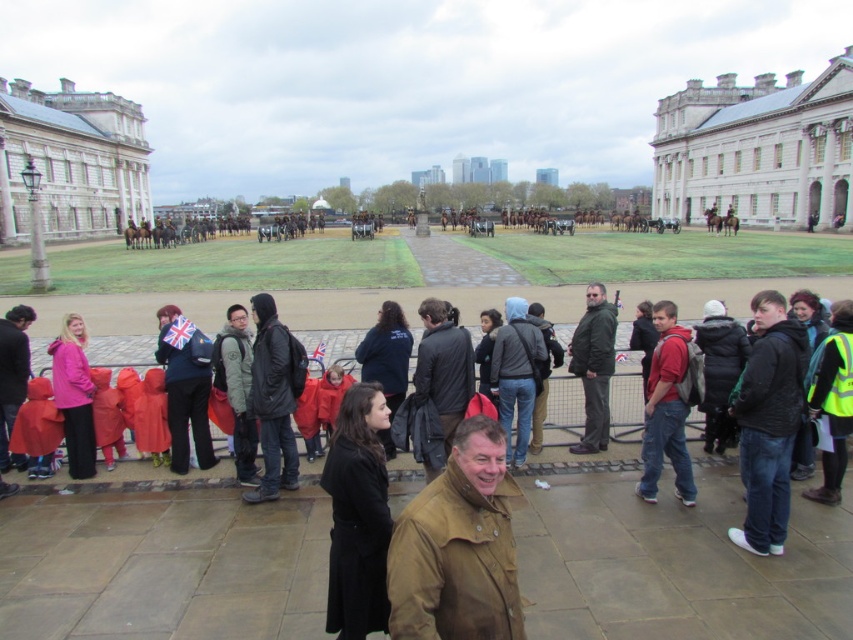
You are standing at the center of the scene and want to locate the white stone building at upper right. What are its coordinates?

The white stone building at upper right is located at coordinates point (758, 148).

You are standing at the center of the scene. Which direction should you look to see the white glossy building at upper left?

The white glossy building at upper left is located at coordinates (71, 161), which is to the upper left direction from your current position at the center.